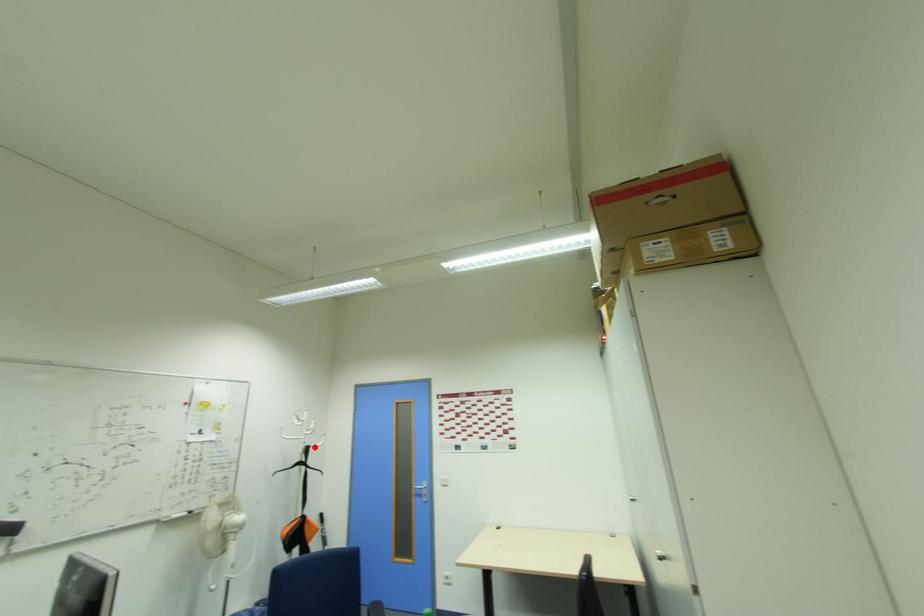
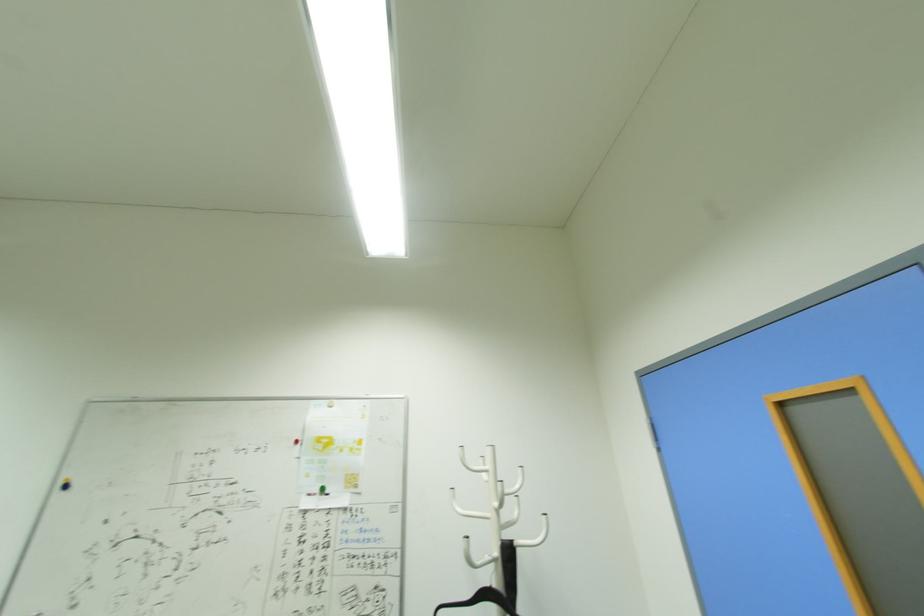
In the second image, find the point that corresponds to the highlighted location in the first image.

(518, 544)